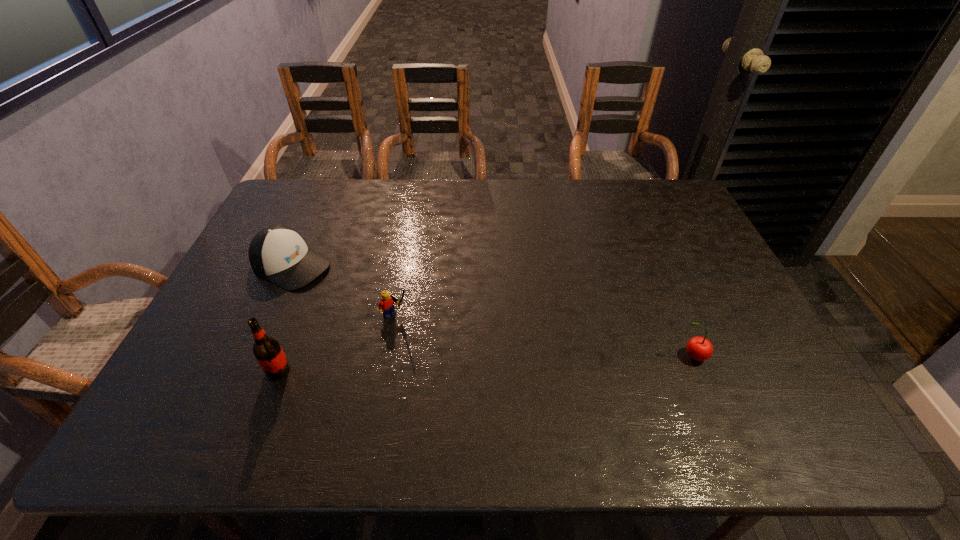
This screenshot has width=960, height=540. What are the coordinates of `the third closest object relative to the root beer` in the screenshot? It's located at (698, 348).

Locate an element on the screen. The width and height of the screenshot is (960, 540). vacant space that satisfies the following two spatial constraints: 1. on the front side of the cap; 2. on the right side of the second farthest object is located at coordinates (269, 315).

At what (x,y) coordinates should I click in order to perform the action: click on free point that satisfies the following two spatial constraints: 1. on the front side of the tallest object; 2. on the right side of the farthest object. Please return your answer as a coordinate pair (x, y). Looking at the image, I should click on (244, 370).

The image size is (960, 540). Identify the location of free space that satisfies the following two spatial constraints: 1. on the front side of the Lego; 2. on the right side of the farthest object. (269, 315).

At what (x,y) coordinates should I click in order to perform the action: click on vacant space that satisfies the following two spatial constraints: 1. on the front side of the rightmost object; 2. on the left side of the farthest object. Please return your answer as a coordinate pair (x, y). Looking at the image, I should click on (250, 356).